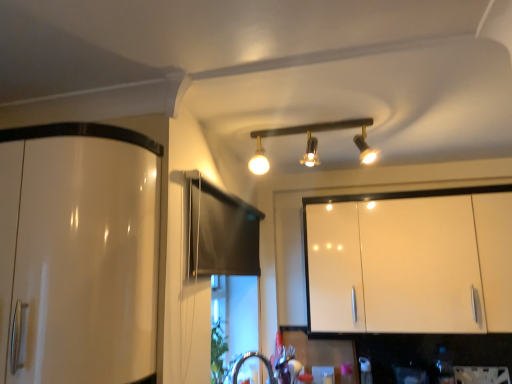
Question: Can we say white glossy cabinet at upper right, acting as the 1th cabinetry starting from the right, lies outside matte black track lights at center?

Choices:
 (A) no
 (B) yes

Answer: (B)

Question: Is white glossy cabinet at upper right, acting as the 1th cabinetry starting from the right, to the left of matte black track lights at center from the viewer's perspective?

Choices:
 (A) yes
 (B) no

Answer: (B)

Question: Does white glossy cabinet at upper right, the 2th cabinetry positioned from the left, have a greater width compared to matte black track lights at center?

Choices:
 (A) no
 (B) yes

Answer: (A)

Question: Is the surface of white glossy cabinet at upper right, the 2th cabinetry positioned from the left, in direct contact with matte black track lights at center?

Choices:
 (A) no
 (B) yes

Answer: (A)

Question: Could you tell me if white glossy cabinet at upper right, the 2th cabinetry positioned from the left, is turned towards matte black track lights at center?

Choices:
 (A) yes
 (B) no

Answer: (A)

Question: Considering the relative sizes of white glossy cabinet at upper right, marked as the 2th cabinetry in a front-to-back arrangement, and matte black track lights at center in the image provided, is white glossy cabinet at upper right, marked as the 2th cabinetry in a front-to-back arrangement, smaller than matte black track lights at center?

Choices:
 (A) yes
 (B) no

Answer: (B)

Question: Is glossy white cabinet at left, the second cabinetry positioned from the back, facing towards white glossy cabinet at upper right, marked as the 2th cabinetry in a front-to-back arrangement?

Choices:
 (A) no
 (B) yes

Answer: (A)

Question: Considering the relative sizes of glossy white cabinet at left, the second cabinetry positioned from the back, and white glossy cabinet at upper right, the 2th cabinetry positioned from the left, in the image provided, is glossy white cabinet at left, the second cabinetry positioned from the back, taller than white glossy cabinet at upper right, the 2th cabinetry positioned from the left,?

Choices:
 (A) yes
 (B) no

Answer: (B)

Question: Considering the relative sizes of glossy white cabinet at left, the second cabinetry positioned from the back, and white glossy cabinet at upper right, marked as the 2th cabinetry in a front-to-back arrangement, in the image provided, is glossy white cabinet at left, the second cabinetry positioned from the back, thinner than white glossy cabinet at upper right, marked as the 2th cabinetry in a front-to-back arrangement,?

Choices:
 (A) no
 (B) yes

Answer: (B)

Question: Can you confirm if glossy white cabinet at left, acting as the first cabinetry starting from the front, is shorter than white glossy cabinet at upper right, acting as the 1th cabinetry starting from the right?

Choices:
 (A) no
 (B) yes

Answer: (B)

Question: Is white glossy cabinet at upper right, marked as the 2th cabinetry in a front-to-back arrangement, a part of glossy white cabinet at left, the second cabinetry positioned from the back?

Choices:
 (A) yes
 (B) no

Answer: (B)

Question: From a real-world perspective, is glossy white cabinet at left, the 1th cabinetry positioned from the left, located beneath white glossy cabinet at upper right, which is the first cabinetry in back-to-front order?

Choices:
 (A) no
 (B) yes

Answer: (B)

Question: Is glossy white cabinet at left, acting as the first cabinetry starting from the front, far from matte black track lights at center?

Choices:
 (A) no
 (B) yes

Answer: (B)